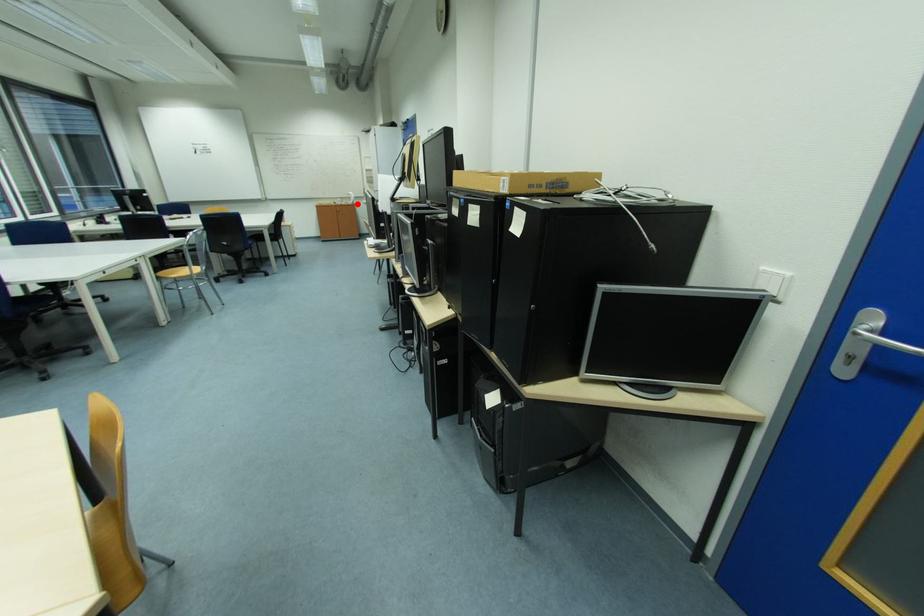
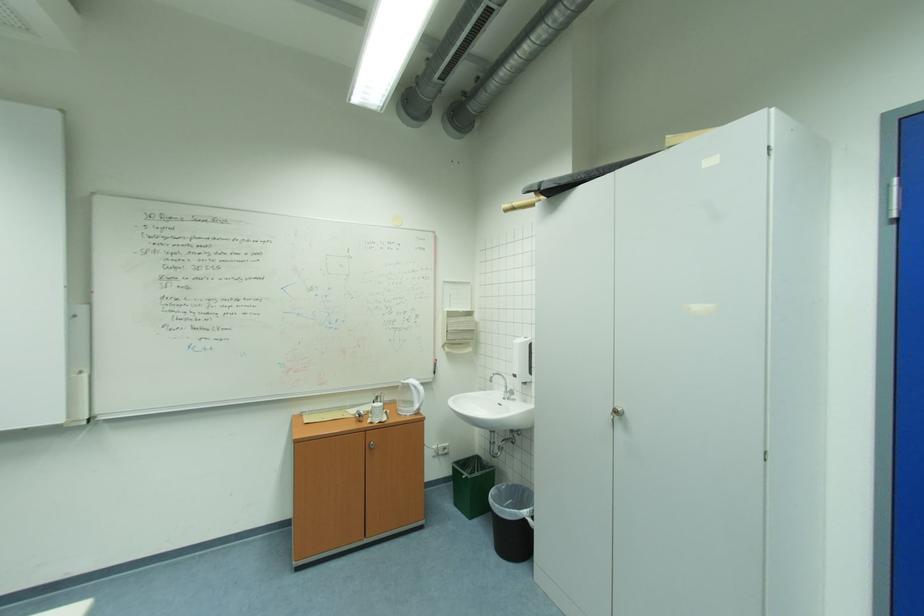
Question: I am providing you with two images of the same scene from different viewpoints. Image1 has a red point marked. In image2, the corresponding 3D location appears at what relative position? Reply with the corresponding letter.

Choices:
 (A) Closer
 (B) Farther

Answer: (A)